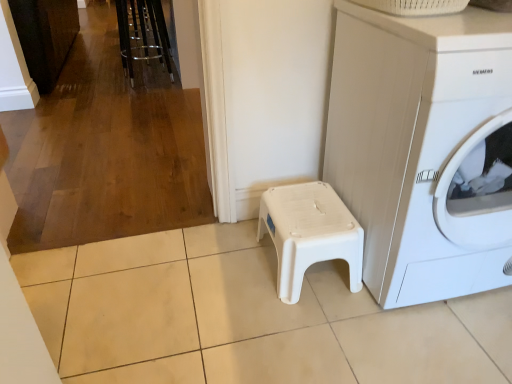
Measure the distance between white plastic washing machine at lower right and camera.

The distance of white plastic washing machine at lower right from camera is 36.47 inches.

Locate an element on the screen. The image size is (512, 384). metallic chrome bar stool at upper left is located at coordinates (143, 34).

You are a GUI agent. You are given a task and a screenshot of the screen. Output one action in this format:
    pyautogui.click(x=<x>, y=<y>)
    Task: Click on the washing machine on the right of metallic chrome bar stool at upper left
    Image resolution: width=512 pixels, height=384 pixels.
    Given the screenshot: What is the action you would take?
    pyautogui.click(x=424, y=149)

From the image's perspective, would you say white plastic washing machine at lower right is shown under metallic chrome bar stool at upper left?

Yes.

From their relative heights in the image, would you say white plastic washing machine at lower right is taller or shorter than metallic chrome bar stool at upper left?

Considering their sizes, white plastic washing machine at lower right has more height than metallic chrome bar stool at upper left.

Who is smaller, white plastic washing machine at lower right or metallic chrome bar stool at upper left?

Smaller between the two is metallic chrome bar stool at upper left.

Which is in front, white plastic washing machine at lower right or white plastic stool at center?

white plastic washing machine at lower right is in front.

Does point (469, 63) come in front of point (341, 229)?

Yes, point (469, 63) is in front of point (341, 229).

Considering the sizes of white plastic washing machine at lower right and white plastic stool at center in the image, is white plastic washing machine at lower right wider or thinner than white plastic stool at center?

Considering their sizes, white plastic washing machine at lower right looks broader than white plastic stool at center.

Consider the image. From the image's perspective, is metallic chrome bar stool at upper left over white plastic stool at center?

Correct, metallic chrome bar stool at upper left appears higher than white plastic stool at center in the image.

This screenshot has height=384, width=512. Find the location of `music stool in front of the metallic chrome bar stool at upper left`. music stool in front of the metallic chrome bar stool at upper left is located at coordinates (309, 233).

Is there a large distance between metallic chrome bar stool at upper left and white plastic stool at center?

Yes, metallic chrome bar stool at upper left and white plastic stool at center are located far from each other.

Is metallic chrome bar stool at upper left turned away from white plastic stool at center?

metallic chrome bar stool at upper left does not have its back to white plastic stool at center.

Does metallic chrome bar stool at upper left turn towards white plastic washing machine at lower right?

No.

Locate an element on the screen. The height and width of the screenshot is (384, 512). washing machine on the right of metallic chrome bar stool at upper left is located at coordinates (424, 149).

Which point is more forward, (149, 16) or (505, 39)?

The point (505, 39) is in front.

From a real-world perspective, which object rests below the other?

metallic chrome bar stool at upper left is physically lower.

Do you think white plastic stool at center is within metallic chrome bar stool at upper left, or outside of it?

white plastic stool at center is not inside metallic chrome bar stool at upper left, it's outside.

This screenshot has width=512, height=384. Find the location of `bar stool behind the white plastic stool at center`. bar stool behind the white plastic stool at center is located at coordinates (143, 34).

From the image's perspective, would you say white plastic stool at center is positioned over metallic chrome bar stool at upper left?

No, from the image's perspective, white plastic stool at center is not on top of metallic chrome bar stool at upper left.

What's the angular difference between white plastic stool at center and metallic chrome bar stool at upper left's facing directions?

There is a 96-degree angle between the facing directions of white plastic stool at center and metallic chrome bar stool at upper left.

From the image's perspective, is white plastic stool at center located above or below white plastic washing machine at lower right?

white plastic stool at center is below white plastic washing machine at lower right.

Is white plastic stool at center facing towards white plastic washing machine at lower right?

No, white plastic stool at center is not oriented towards white plastic washing machine at lower right.

In the scene shown: Between white plastic stool at center and white plastic washing machine at lower right, which one has larger size?

With larger size is white plastic washing machine at lower right.

The height and width of the screenshot is (384, 512). Identify the location of washing machine lying in front of the metallic chrome bar stool at upper left. (424, 149).

Find the location of `music stool located underneath the white plastic washing machine at lower right (from a real-world perspective)`. music stool located underneath the white plastic washing machine at lower right (from a real-world perspective) is located at coordinates (309, 233).

From the image, which object appears to be nearer to metallic chrome bar stool at upper left, white plastic stool at center or white plastic washing machine at lower right?

white plastic stool at center.

When comparing their distances from white plastic washing machine at lower right, does metallic chrome bar stool at upper left or white plastic stool at center seem closer?

Based on the image, white plastic stool at center appears to be nearer to white plastic washing machine at lower right.

When comparing their distances from white plastic stool at center, does white plastic washing machine at lower right or metallic chrome bar stool at upper left seem closer?

The object closer to white plastic stool at center is white plastic washing machine at lower right.

When comparing their distances from metallic chrome bar stool at upper left, does white plastic washing machine at lower right or white plastic stool at center seem closer?

Among the two, white plastic stool at center is located nearer to metallic chrome bar stool at upper left.

From the image, which object appears to be farther from white plastic washing machine at lower right, white plastic stool at center or metallic chrome bar stool at upper left?

The object further to white plastic washing machine at lower right is metallic chrome bar stool at upper left.

Considering their positions, is metallic chrome bar stool at upper left positioned closer to white plastic stool at center than white plastic washing machine at lower right?

The object closer to white plastic stool at center is white plastic washing machine at lower right.

You are a GUI agent. You are given a task and a screenshot of the screen. Output one action in this format:
    pyautogui.click(x=<x>, y=<y>)
    Task: Click on the music stool between white plastic washing machine at lower right and metallic chrome bar stool at upper left from front to back
    The width and height of the screenshot is (512, 384).
    Given the screenshot: What is the action you would take?
    coord(309,233)